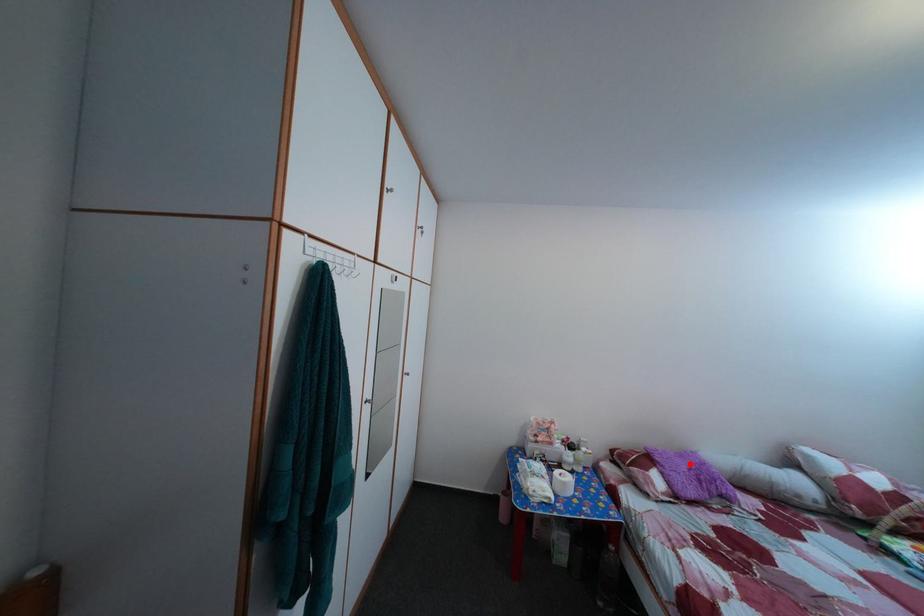
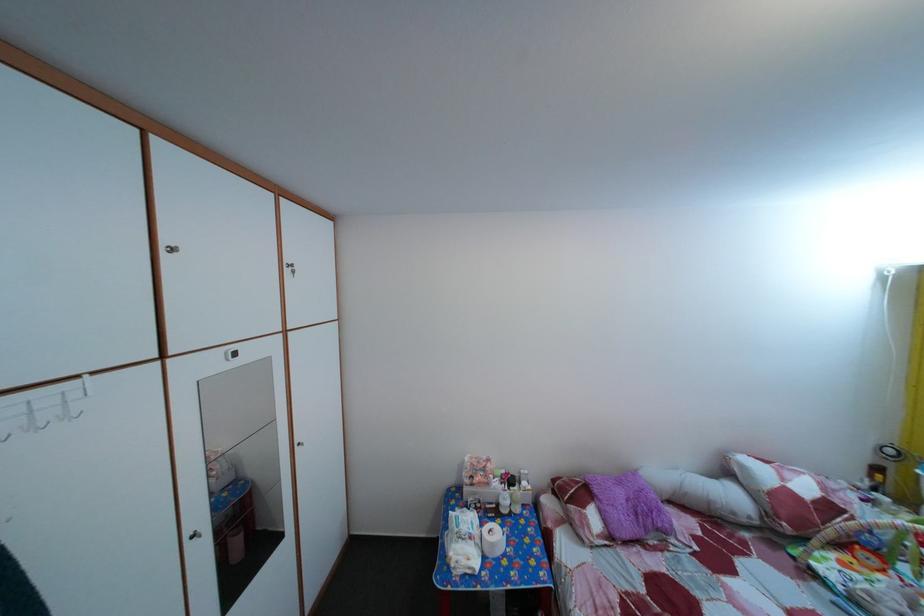
Locate, in the second image, the point that corresponds to the highlighted location in the first image.

(629, 491)